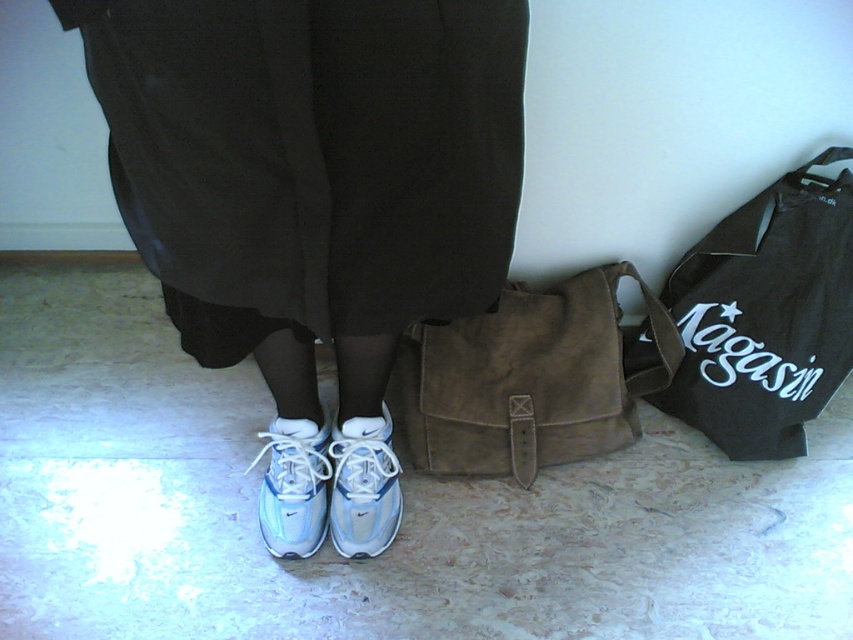
Question: Which object appears farthest from the camera in this image?

Choices:
 (A) white suede sneakers at center
 (B) white mesh shoe at lower center
 (C) black canvas tote bag at right

Answer: (C)

Question: Which of the following is the closest to the observer?

Choices:
 (A) black canvas tote bag at right
 (B) white suede sneakers at center
 (C) suede brown bag at center

Answer: (B)

Question: Does white suede sneakers at center have a greater width compared to white suede shoe at center?

Choices:
 (A) no
 (B) yes

Answer: (B)

Question: Can you confirm if suede brown bag at center is smaller than white suede shoe at center?

Choices:
 (A) yes
 (B) no

Answer: (B)

Question: Is white suede shoe at center to the left of white mesh shoe at lower center from the viewer's perspective?

Choices:
 (A) no
 (B) yes

Answer: (A)

Question: Which point is farther from the camera taking this photo?

Choices:
 (A) (287, 516)
 (B) (686, 364)
 (C) (515, 116)
 (D) (392, 518)

Answer: (B)